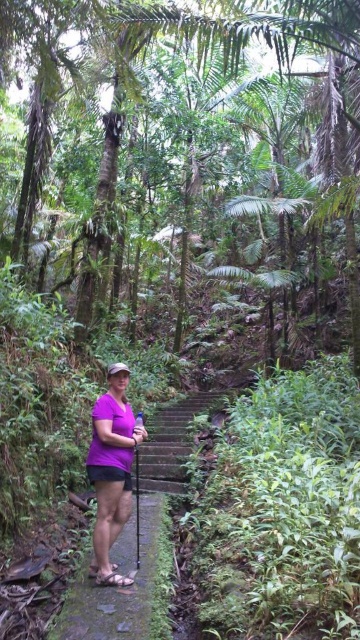
How much distance is there between brown stone trail at center and purple matte shirt at center?

brown stone trail at center is 70.26 centimeters away from purple matte shirt at center.

Is brown stone trail at center bigger than purple matte shirt at center?

Correct, brown stone trail at center is larger in size than purple matte shirt at center.

I want to click on brown stone trail at center, so click(119, 588).